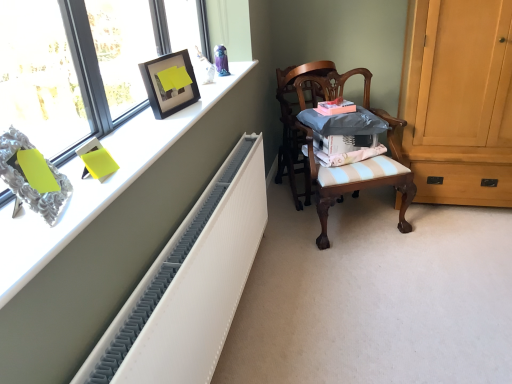
Where is `vacant area located to the right-hand side of matte black picture frame at upper left`? vacant area located to the right-hand side of matte black picture frame at upper left is located at coordinates (199, 107).